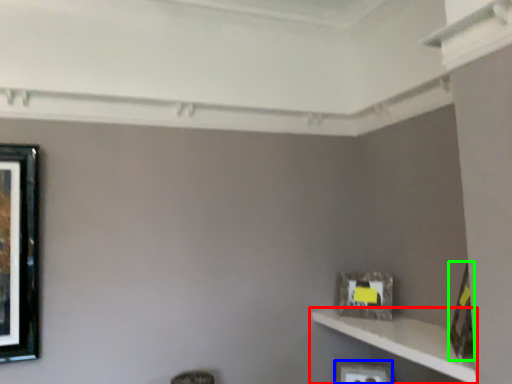
Question: Which is farther away from shelf (highlighted by a red box)? picture frame (highlighted by a blue box) or picture frame (highlighted by a green box)?

Choices:
 (A) picture frame
 (B) picture frame

Answer: (A)